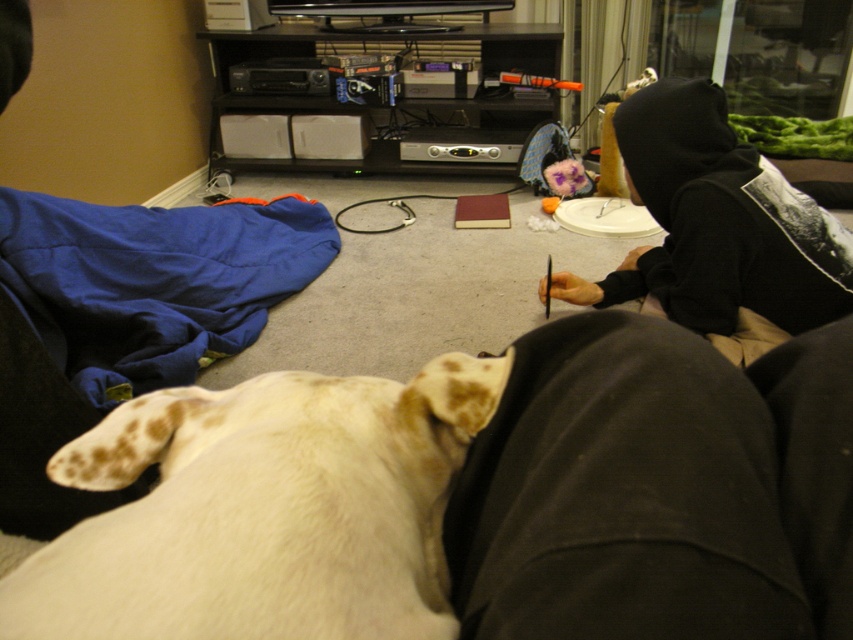
Is white fur dog at lower left further to the viewer compared to black hoodie at upper right?

No, it is in front of black hoodie at upper right.

Between point (308, 561) and point (726, 339), which one is positioned behind?

The point (726, 339) is behind.

Who is more forward, (113, 579) or (741, 264)?

Point (113, 579)

Identify the location of white fur dog at lower left. This screenshot has width=853, height=640. (263, 509).